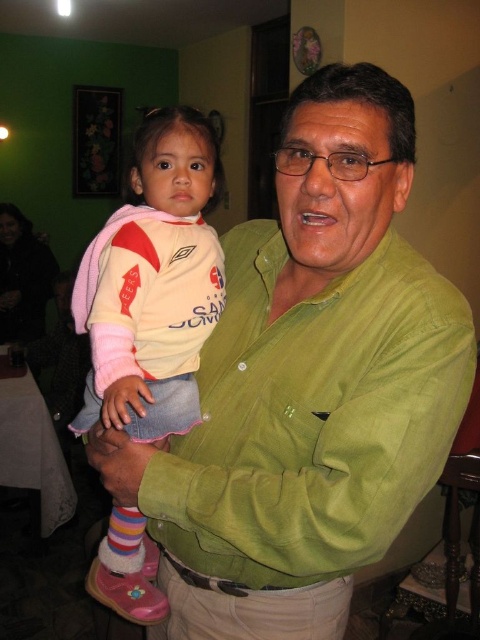
Question: Estimate the real-world distances between objects in this image. Which object is farther from the green suede shirt at center?

Choices:
 (A) green corduroy shirt at center
 (B) pink fabric shirt at center

Answer: (B)

Question: Can you confirm if green corduroy shirt at center is positioned to the left of pink fabric shirt at center?

Choices:
 (A) yes
 (B) no

Answer: (B)

Question: Which object is positioned farthest from the pink fabric shirt at center?

Choices:
 (A) green corduroy shirt at center
 (B) green suede shirt at center

Answer: (A)

Question: Is green suede shirt at center closer to the viewer compared to pink fabric shirt at center?

Choices:
 (A) no
 (B) yes

Answer: (B)

Question: Which of the following is the closest to the observer?

Choices:
 (A) pink fabric shirt at center
 (B) green corduroy shirt at center

Answer: (B)

Question: Can you confirm if green suede shirt at center is positioned below green corduroy shirt at center?

Choices:
 (A) yes
 (B) no

Answer: (A)